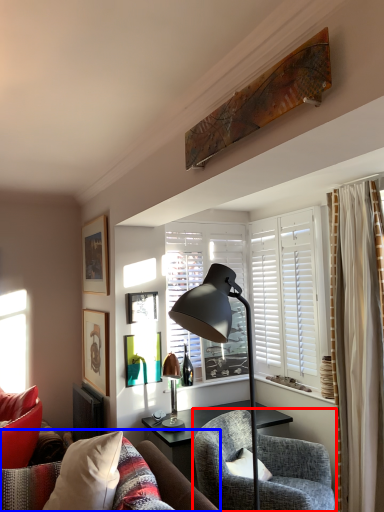
Question: Which object is closer to the camera taking this photo, chair (highlighted by a red box) or studio couch (highlighted by a blue box)?

Choices:
 (A) chair
 (B) studio couch

Answer: (B)